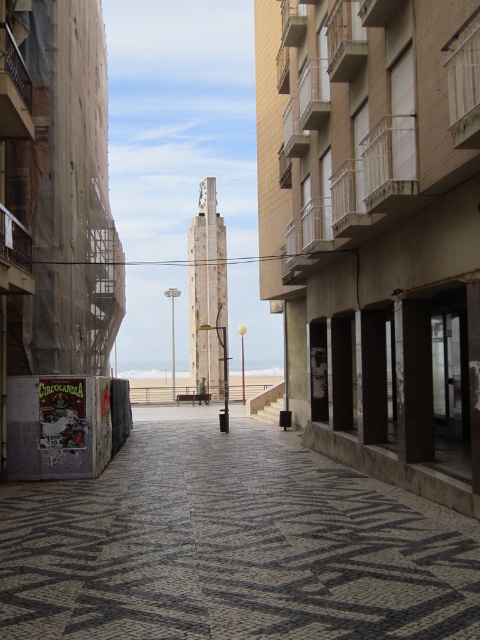
Is black textured pavement at center shorter than white sand at center?

Indeed, black textured pavement at center has a lesser height compared to white sand at center.

Is point (409, 625) positioned before point (269, 376)?

Yes, it is.

Does point (72, 560) lie in front of point (228, 396)?

Yes.

The width and height of the screenshot is (480, 640). What are the coordinates of `black textured pavement at center` in the screenshot? It's located at pyautogui.click(x=231, y=545).